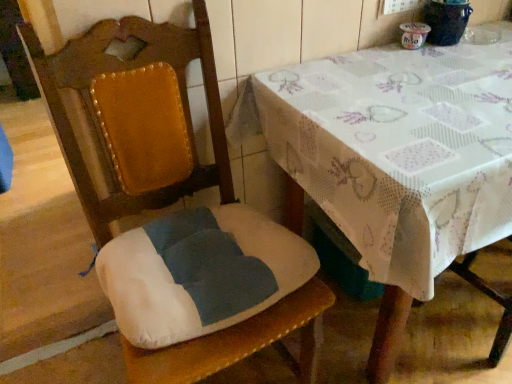
I want to click on white printed tablecloth at upper right, so click(398, 160).

This screenshot has width=512, height=384. Describe the element at coordinates (398, 160) in the screenshot. I see `white printed tablecloth at upper right` at that location.

What is the approximate width of white printed tablecloth at upper right?

white printed tablecloth at upper right is 70.79 centimeters in width.

Measure the distance between point (315, 302) and camera.

36.18 inches.

At what (x,y) coordinates should I click in order to perform the action: click on velvet cushioned chair at center. Please return your answer as a coordinate pair (x, y). This screenshot has width=512, height=384. Looking at the image, I should click on (241, 343).

Image resolution: width=512 pixels, height=384 pixels. What do you see at coordinates (241, 343) in the screenshot?
I see `velvet cushioned chair at center` at bounding box center [241, 343].

The image size is (512, 384). Identify the location of white printed tablecloth at upper right. (398, 160).

Between white printed tablecloth at upper right and velvet cushioned chair at center, which one appears on the right side from the viewer's perspective?

white printed tablecloth at upper right.

Which object is closer to the camera, white printed tablecloth at upper right or velvet cushioned chair at center?

velvet cushioned chair at center is in front.

Is point (437, 215) closer to camera compared to point (74, 62)?

That is True.

From the image's perspective, is white printed tablecloth at upper right above or below velvet cushioned chair at center?

Clearly, from the image's perspective, white printed tablecloth at upper right is above velvet cushioned chair at center.

From a real-world perspective, who is located lower, white printed tablecloth at upper right or velvet cushioned chair at center?

From a 3D spatial view, white printed tablecloth at upper right is below.

In terms of width, does white printed tablecloth at upper right look wider or thinner when compared to velvet cushioned chair at center?

white printed tablecloth at upper right is wider than velvet cushioned chair at center.

Is white printed tablecloth at upper right taller or shorter than velvet cushioned chair at center?

Considering their sizes, white printed tablecloth at upper right has less height than velvet cushioned chair at center.

Is white printed tablecloth at upper right smaller than velvet cushioned chair at center?

No.

Is white printed tablecloth at upper right positioned beyond the bounds of velvet cushioned chair at center?

Yes, white printed tablecloth at upper right is located beyond the bounds of velvet cushioned chair at center.

Is white printed tablecloth at upper right directly adjacent to velvet cushioned chair at center?

There is a gap between white printed tablecloth at upper right and velvet cushioned chair at center.

Is white printed tablecloth at upper right oriented away from velvet cushioned chair at center?

white printed tablecloth at upper right does not have its back to velvet cushioned chair at center.

Locate an element on the screen. table behind the velvet cushioned chair at center is located at coordinates (398, 160).

Consider the image. Between velvet cushioned chair at center and white printed tablecloth at upper right, which one appears on the left side from the viewer's perspective?

Positioned to the left is velvet cushioned chair at center.

Is velvet cushioned chair at center closer to camera compared to white printed tablecloth at upper right?

Yes.

Is point (220, 174) positioned after point (346, 86)?

Yes, point (220, 174) is farther from viewer.

From the image's perspective, is velvet cushioned chair at center located above white printed tablecloth at upper right?

Actually, velvet cushioned chair at center appears below white printed tablecloth at upper right in the image.

From a real-world perspective, between velvet cushioned chair at center and white printed tablecloth at upper right, who is vertically lower?

From a 3D spatial view, white printed tablecloth at upper right is below.

In terms of width, does velvet cushioned chair at center look wider or thinner when compared to white printed tablecloth at upper right?

velvet cushioned chair at center is thinner than white printed tablecloth at upper right.

Between velvet cushioned chair at center and white printed tablecloth at upper right, which one has more height?

velvet cushioned chair at center is taller.

Consider the image. Which of these two, velvet cushioned chair at center or white printed tablecloth at upper right, is bigger?

Answer: Bigger between the two is white printed tablecloth at upper right.

Is velvet cushioned chair at center spatially inside white printed tablecloth at upper right, or outside of it?

velvet cushioned chair at center lies outside white printed tablecloth at upper right.

Is velvet cushioned chair at center far from white printed tablecloth at upper right?

Actually, velvet cushioned chair at center and white printed tablecloth at upper right are a little close together.

Based on the photo, is velvet cushioned chair at center turned away from white printed tablecloth at upper right?

That's not correct — velvet cushioned chair at center is not looking away from white printed tablecloth at upper right.

Looking at this image, how far apart are velvet cushioned chair at center and white printed tablecloth at upper right?

They are 18.09 inches apart.

What are the coordinates of `chair below the white printed tablecloth at upper right (from the image's perspective)` in the screenshot? It's located at (241, 343).

The height and width of the screenshot is (384, 512). Find the location of `chair above the white printed tablecloth at upper right (from a real-world perspective)`. chair above the white printed tablecloth at upper right (from a real-world perspective) is located at coordinates point(241,343).

Locate an element on the screen. chair located on the left of white printed tablecloth at upper right is located at coordinates (241, 343).